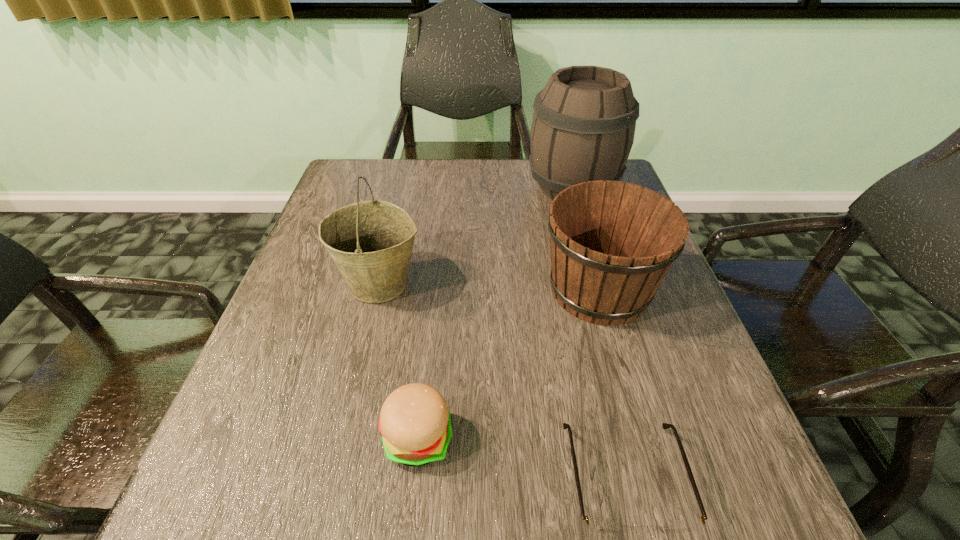
At what (x,y) coordinates should I click in order to perform the action: click on empty space between the farthest wine bucket and the fourth tallest object. Please return your answer as a coordinate pair (x, y). Looking at the image, I should click on (495, 313).

Where is `free point between the third shortest object and the second tallest wine bucket`? Image resolution: width=960 pixels, height=540 pixels. free point between the third shortest object and the second tallest wine bucket is located at coordinates (490, 287).

This screenshot has height=540, width=960. In order to click on empty space between the farthest wine bucket and the hamburger in this screenshot , I will do `click(495, 313)`.

This screenshot has width=960, height=540. Identify the location of vacant area between the third shortest object and the hamburger. (x=509, y=364).

Select which object appears as the closest to the fourth shortest object. Please provide its 2D coordinates. Your answer should be formatted as a tuple, i.e. [(x, y)], where the tuple contains the x and y coordinates of a point satisfying the conditions above.

[(415, 424)]

The width and height of the screenshot is (960, 540). What are the coordinates of `object that is the fourth closest to the shortest object` in the screenshot? It's located at (583, 127).

You are a GUI agent. You are given a task and a screenshot of the screen. Output one action in this format:
    pyautogui.click(x=<x>, y=<y>)
    Task: Click on the wine bucket that stands as the second closest to the leftmost wine bucket
    Image resolution: width=960 pixels, height=540 pixels.
    Given the screenshot: What is the action you would take?
    pyautogui.click(x=583, y=127)

Where is `wine bucket object that ranks as the closest to the farthest wine bucket`? wine bucket object that ranks as the closest to the farthest wine bucket is located at coordinates (612, 243).

You are a GUI agent. You are given a task and a screenshot of the screen. Output one action in this format:
    pyautogui.click(x=<x>, y=<y>)
    Task: Click on the vacant point that satisfies the following two spatial constraints: 1. on the back side of the leftmost wine bucket; 2. on the left side of the farthest wine bucket
    The height and width of the screenshot is (540, 960).
    Given the screenshot: What is the action you would take?
    click(x=402, y=188)

This screenshot has width=960, height=540. What are the coordinates of `free spot that satisfies the following two spatial constraints: 1. on the back side of the farthest wine bucket; 2. on the left side of the second shortest object` in the screenshot? It's located at (445, 188).